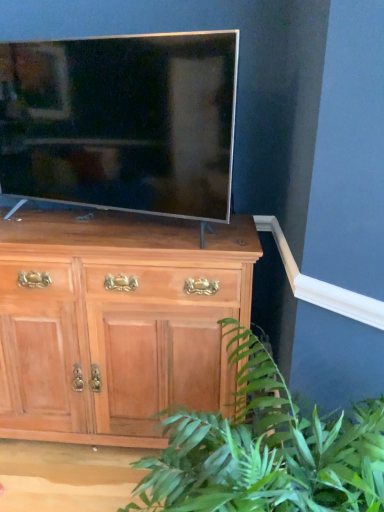
Question: Does satin silver tv at center have a larger size compared to light brown wood chest of drawers at center?

Choices:
 (A) yes
 (B) no

Answer: (B)

Question: Considering the relative sizes of satin silver tv at center and light brown wood chest of drawers at center in the image provided, is satin silver tv at center taller than light brown wood chest of drawers at center?

Choices:
 (A) yes
 (B) no

Answer: (B)

Question: Is satin silver tv at center thinner than light brown wood chest of drawers at center?

Choices:
 (A) no
 (B) yes

Answer: (B)

Question: Can light brown wood chest of drawers at center be found inside satin silver tv at center?

Choices:
 (A) no
 (B) yes

Answer: (A)

Question: Is satin silver tv at center at the left side of light brown wood chest of drawers at center?

Choices:
 (A) no
 (B) yes

Answer: (A)

Question: Is satin silver tv at center in contact with light brown wood chest of drawers at center?

Choices:
 (A) no
 (B) yes

Answer: (A)

Question: From the image's perspective, is satin silver tv at center over green leafy plant at lower right?

Choices:
 (A) yes
 (B) no

Answer: (A)

Question: Considering the relative positions of satin silver tv at center and green leafy plant at lower right in the image provided, is satin silver tv at center to the right of green leafy plant at lower right from the viewer's perspective?

Choices:
 (A) yes
 (B) no

Answer: (B)

Question: Is green leafy plant at lower right at the back of satin silver tv at center?

Choices:
 (A) no
 (B) yes

Answer: (A)

Question: From a real-world perspective, is satin silver tv at center below green leafy plant at lower right?

Choices:
 (A) no
 (B) yes

Answer: (A)

Question: Is satin silver tv at center shorter than green leafy plant at lower right?

Choices:
 (A) no
 (B) yes

Answer: (B)

Question: Is satin silver tv at center facing towards green leafy plant at lower right?

Choices:
 (A) yes
 (B) no

Answer: (B)

Question: Is light brown wood chest of drawers at center directly adjacent to green leafy plant at lower right?

Choices:
 (A) no
 (B) yes

Answer: (A)